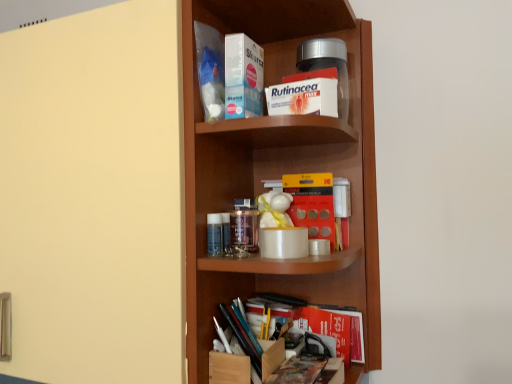
Question: Is red paper book at lower center, which is the 5th book from top to bottom, shorter than matte yellow door at left?

Choices:
 (A) yes
 (B) no

Answer: (A)

Question: Can you confirm if red paper book at lower center, positioned as the 1th book in bottom-to-top order, is thinner than matte yellow door at left?

Choices:
 (A) yes
 (B) no

Answer: (A)

Question: Can we say red paper book at lower center, positioned as the 1th book in bottom-to-top order, lies outside matte yellow door at left?

Choices:
 (A) yes
 (B) no

Answer: (A)

Question: Is red paper book at lower center, which is the 5th book from top to bottom, not near matte yellow door at left?

Choices:
 (A) no
 (B) yes

Answer: (A)

Question: From the image's perspective, does red paper book at lower center, positioned as the 1th book in bottom-to-top order, appear higher than matte yellow door at left?

Choices:
 (A) yes
 (B) no

Answer: (B)

Question: In terms of height, does wooden shelf at center look taller or shorter compared to yellow matte kodak film at center, arranged as the 2th book when ordered from the bottom?

Choices:
 (A) tall
 (B) short

Answer: (A)

Question: Is point (151, 254) closer or farther from the camera than point (329, 180)?

Choices:
 (A) closer
 (B) farther

Answer: (A)

Question: Relative to yellow matte kodak film at center, arranged as the fourth book when viewed from the top, is wooden shelf at center in front or behind?

Choices:
 (A) front
 (B) behind

Answer: (A)

Question: Considering the positions of wooden shelf at center and yellow matte kodak film at center, arranged as the 2th book when ordered from the bottom, in the image, is wooden shelf at center bigger or smaller than yellow matte kodak film at center, arranged as the 2th book when ordered from the bottom,?

Choices:
 (A) small
 (B) big

Answer: (B)

Question: Considering the relative positions of blue plastic bag at upper center, which is counted as the fifth book, starting from the bottom, and wooden shelf at center in the image provided, is blue plastic bag at upper center, which is counted as the fifth book, starting from the bottom, to the left or to the right of wooden shelf at center?

Choices:
 (A) right
 (B) left

Answer: (B)

Question: From the image's perspective, relative to wooden shelf at center, is blue plastic bag at upper center, which is counted as the fifth book, starting from the bottom, above or below?

Choices:
 (A) below
 (B) above

Answer: (B)

Question: Considering the positions of point (200, 23) and point (162, 359), is point (200, 23) closer or farther from the camera than point (162, 359)?

Choices:
 (A) closer
 (B) farther

Answer: (B)

Question: From a real-world perspective, is blue plastic bag at upper center, which is counted as the fifth book, starting from the bottom, above or below wooden shelf at center?

Choices:
 (A) below
 (B) above

Answer: (B)

Question: In terms of width, does transparent glass jar at center look wider or thinner when compared to blue plastic bag at upper center, which is counted as the fifth book, starting from the bottom?

Choices:
 (A) wide
 (B) thin

Answer: (A)

Question: Considering the positions of transparent glass jar at center and blue plastic bag at upper center, which appears as the first book when viewed from the top, in the image, is transparent glass jar at center taller or shorter than blue plastic bag at upper center, which appears as the first book when viewed from the top,?

Choices:
 (A) tall
 (B) short

Answer: (B)